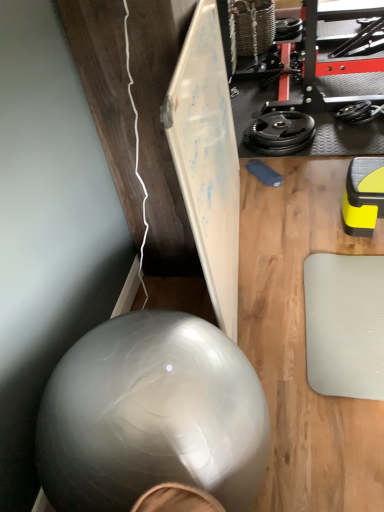
The image size is (384, 512). What do you see at coordinates (280, 130) in the screenshot?
I see `black rubber weight at upper right` at bounding box center [280, 130].

This screenshot has height=512, width=384. In order to click on black rubber weight at upper right in this screenshot , I will do `click(280, 130)`.

In order to face transparent rubber ball at lower left, should I rotate leftwards or rightwards?

Rotate your view left by about 4.407°.

What do you see at coordinates (151, 415) in the screenshot?
I see `transparent rubber ball at lower left` at bounding box center [151, 415].

Locate an element on the screen. The image size is (384, 512). transparent rubber ball at lower left is located at coordinates (151, 415).

You are a GUI agent. You are given a task and a screenshot of the screen. Output one action in this format:
    pyautogui.click(x=<x>, y=<y>)
    Task: Click on the black rubber weight at upper right
    This screenshot has height=512, width=384.
    Given the screenshot: What is the action you would take?
    pyautogui.click(x=280, y=130)

Is black rubber weight at upper right to the right of transparent rubber ball at lower left from the viewer's perspective?

Correct, you'll find black rubber weight at upper right to the right of transparent rubber ball at lower left.

Considering their positions, is black rubber weight at upper right located in front of or behind transparent rubber ball at lower left?

black rubber weight at upper right is positioned farther from the viewer than transparent rubber ball at lower left.

Which is in front, point (288, 126) or point (229, 388)?

The point (229, 388) is more forward.

Looking at this image, from the image's perspective, which is below, black rubber weight at upper right or transparent rubber ball at lower left?

From the image's view, transparent rubber ball at lower left is below.

From a real-world perspective, which object stands above the other?

In real-world perspective, transparent rubber ball at lower left is above.

Between black rubber weight at upper right and transparent rubber ball at lower left, which one has larger width?

Wider between the two is transparent rubber ball at lower left.

Is black rubber weight at upper right taller than transparent rubber ball at lower left?

Incorrect, the height of black rubber weight at upper right is not larger of that of transparent rubber ball at lower left.

Which of these two, black rubber weight at upper right or transparent rubber ball at lower left, is smaller?

With smaller size is black rubber weight at upper right.

Is black rubber weight at upper right located outside transparent rubber ball at lower left?

That's correct, black rubber weight at upper right is outside of transparent rubber ball at lower left.

Is black rubber weight at upper right touching transparent rubber ball at lower left?

No, black rubber weight at upper right is not next to transparent rubber ball at lower left.

Consider the image. Is black rubber weight at upper right facing towards transparent rubber ball at lower left?

No.

Identify the location of ball on the left of black rubber weight at upper right. This screenshot has height=512, width=384. (151, 415).

Is transparent rubber ball at lower left to the left of black rubber weight at upper right from the viewer's perspective?

Yes, transparent rubber ball at lower left is to the left of black rubber weight at upper right.

Is transparent rubber ball at lower left closer to camera compared to black rubber weight at upper right?

Yes.

Does point (90, 405) lie behind point (272, 116)?

No, it is in front of (272, 116).

From the image's perspective, is transparent rubber ball at lower left located beneath black rubber weight at upper right?

Yes, from the image's perspective, transparent rubber ball at lower left is below black rubber weight at upper right.

Consider the image. From a real-world perspective, is transparent rubber ball at lower left located higher than black rubber weight at upper right?

Indeed, from a real-world perspective, transparent rubber ball at lower left stands above black rubber weight at upper right.

Considering the sizes of objects transparent rubber ball at lower left and black rubber weight at upper right in the image provided, who is thinner, transparent rubber ball at lower left or black rubber weight at upper right?

black rubber weight at upper right is thinner.

From their relative heights in the image, would you say transparent rubber ball at lower left is taller or shorter than black rubber weight at upper right?

transparent rubber ball at lower left is taller than black rubber weight at upper right.

Can you confirm if transparent rubber ball at lower left is bigger than black rubber weight at upper right?

Correct, transparent rubber ball at lower left is larger in size than black rubber weight at upper right.

Would you say transparent rubber ball at lower left is inside or outside black rubber weight at upper right?

transparent rubber ball at lower left is outside black rubber weight at upper right.

Are transparent rubber ball at lower left and black rubber weight at upper right located far from each other?

transparent rubber ball at lower left is far away from black rubber weight at upper right.

Could you tell me if transparent rubber ball at lower left is turned towards black rubber weight at upper right?

No, transparent rubber ball at lower left is not aimed at black rubber weight at upper right.

Looking at this image, how different are the orientations of transparent rubber ball at lower left and black rubber weight at upper right in degrees?

The facing directions of transparent rubber ball at lower left and black rubber weight at upper right are 1.9 degrees apart.

Locate an element on the screen. The height and width of the screenshot is (512, 384). wheel located behind the transparent rubber ball at lower left is located at coordinates (280, 130).

Where is `wheel below the transparent rubber ball at lower left (from a real-world perspective)`? This screenshot has width=384, height=512. wheel below the transparent rubber ball at lower left (from a real-world perspective) is located at coordinates point(280,130).

This screenshot has width=384, height=512. In order to click on ball that is on the left side of black rubber weight at upper right in this screenshot , I will do 151,415.